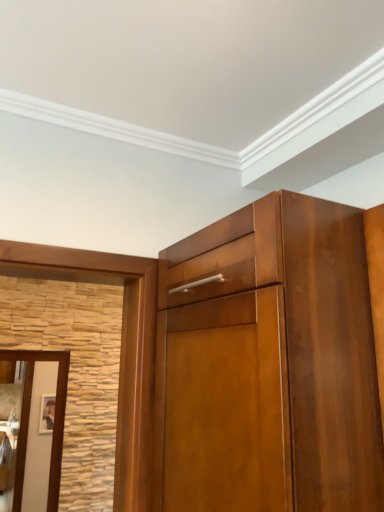
Question: Should I look upward or downward to see brown wooden door at left?

Choices:
 (A) up
 (B) down

Answer: (B)

Question: Is glossy wood cupboard at upper center thinner than brown wooden door at left?

Choices:
 (A) yes
 (B) no

Answer: (B)

Question: From a real-world perspective, is glossy wood cupboard at upper center positioned under brown wooden door at left based on gravity?

Choices:
 (A) yes
 (B) no

Answer: (B)

Question: Is glossy wood cupboard at upper center positioned in front of brown wooden door at left?

Choices:
 (A) yes
 (B) no

Answer: (A)

Question: Is glossy wood cupboard at upper center surrounding brown wooden door at left?

Choices:
 (A) yes
 (B) no

Answer: (B)

Question: Considering the relative positions of glossy wood cupboard at upper center and brown wooden door at left in the image provided, is glossy wood cupboard at upper center to the right of brown wooden door at left from the viewer's perspective?

Choices:
 (A) no
 (B) yes

Answer: (B)

Question: Does glossy wood cupboard at upper center appear on the left side of brown wooden door at left?

Choices:
 (A) yes
 (B) no

Answer: (B)

Question: From a real-world perspective, is brown wooden door at left located beneath glossy wood cupboard at upper center?

Choices:
 (A) yes
 (B) no

Answer: (A)

Question: Is brown wooden door at left bigger than glossy wood cupboard at upper center?

Choices:
 (A) no
 (B) yes

Answer: (A)

Question: Is glossy wood cupboard at upper center completely or partially inside brown wooden door at left?

Choices:
 (A) no
 (B) yes

Answer: (A)

Question: Is brown wooden door at left at the right side of glossy wood cupboard at upper center?

Choices:
 (A) no
 (B) yes

Answer: (A)

Question: From the image's perspective, is brown wooden door at left above glossy wood cupboard at upper center?

Choices:
 (A) yes
 (B) no

Answer: (B)

Question: Is brown wooden door at left positioned behind glossy wood cupboard at upper center?

Choices:
 (A) no
 (B) yes

Answer: (B)

Question: Is brown wooden door at left wider or thinner than glossy wood cupboard at upper center?

Choices:
 (A) thin
 (B) wide

Answer: (A)